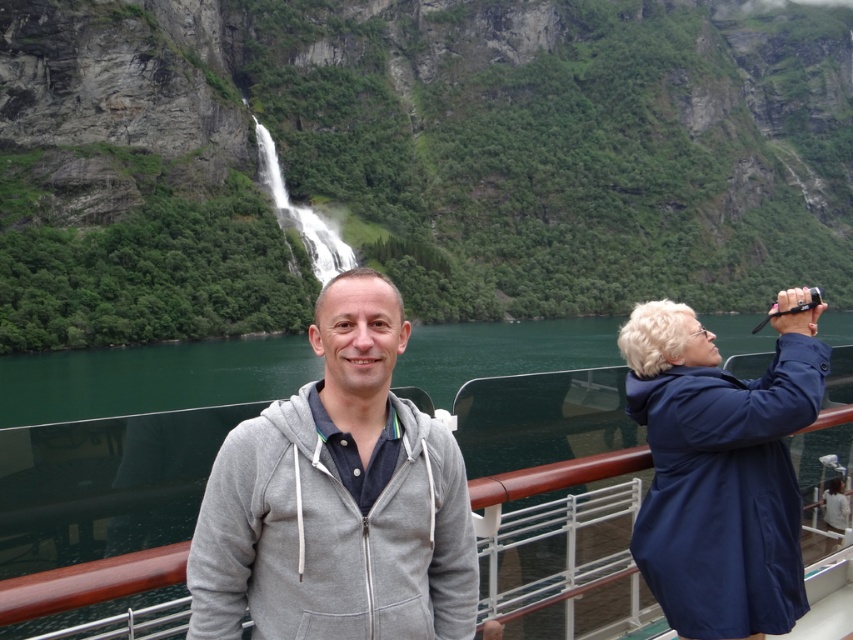
You are standing at the point with coordinates point (436,365) and want to take a photo of the waterfall. There is an obstacle at point (364,548). Will the obstacle block your view of the waterfall?

Point (364,548) is in front of point (436,365), so the obstacle at point (364,548) will block your view of the waterfall.